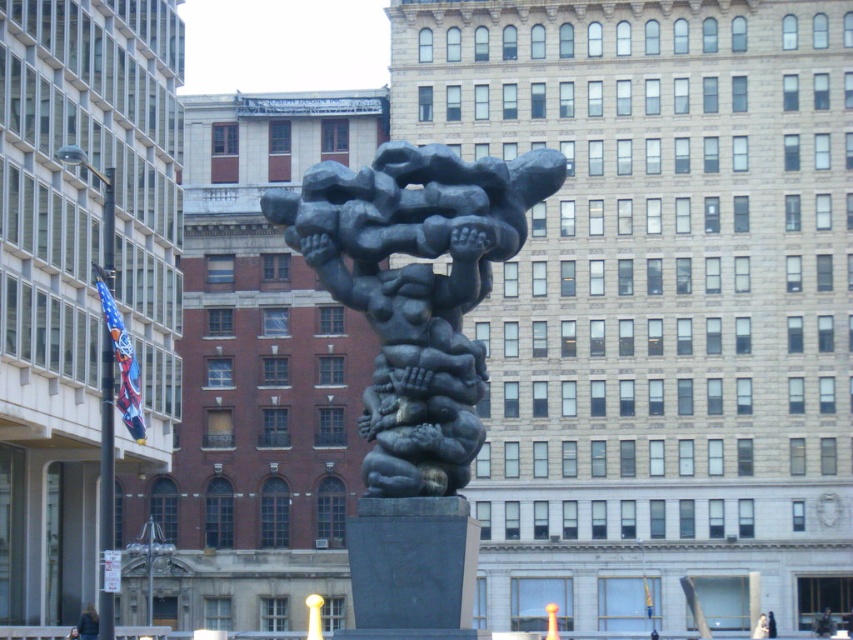
Question: Which object appears farthest from the camera in this image?

Choices:
 (A) bronze sculpture at center
 (B) dark brown hair at lower left

Answer: (B)

Question: Is bronze sculpture at center positioned behind dark brown hair at lower left?

Choices:
 (A) no
 (B) yes

Answer: (A)

Question: Does bronze sculpture at center appear over dark brown hair at lower left?

Choices:
 (A) no
 (B) yes

Answer: (B)

Question: Can you confirm if bronze sculpture at center is thinner than dark brown hair at lower left?

Choices:
 (A) yes
 (B) no

Answer: (B)